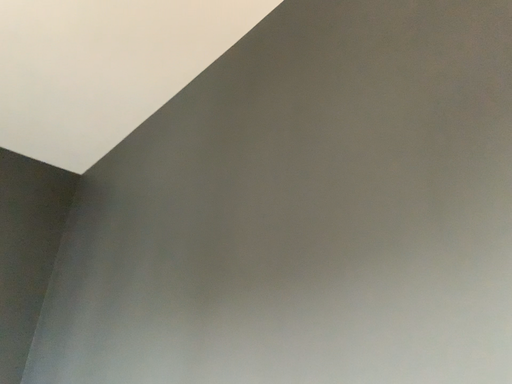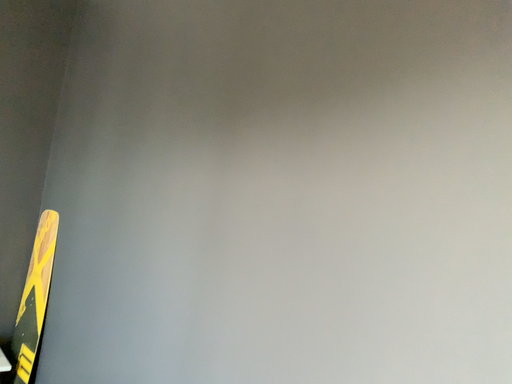
Question: Which way did the camera rotate in the video?

Choices:
 (A) rotated downward
 (B) rotated upward

Answer: (A)